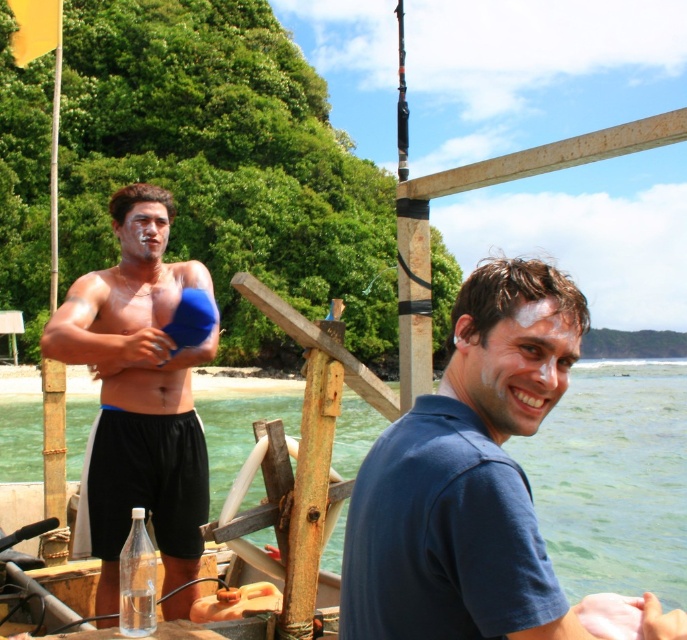
Question: Which is nearer to the clear plastic bottle at center?

Choices:
 (A) black matte shorts at left
 (B) blue cotton shirt at center
 (C) clear water at boat right

Answer: (B)

Question: Among these objects, which one is nearest to the camera?

Choices:
 (A) black matte shorts at left
 (B) clear plastic bottle at center
 (C) clear water at boat right
 (D) blue cotton shirt at center

Answer: (D)

Question: Which object is positioned closest to the black matte shorts at left?

Choices:
 (A) blue cotton shirt at center
 (B) clear water at boat right
 (C) clear plastic bottle at center

Answer: (C)

Question: Is blue cotton shirt at center smaller than black matte shorts at left?

Choices:
 (A) no
 (B) yes

Answer: (B)

Question: Does black matte shorts at left have a greater width compared to clear plastic bottle at center?

Choices:
 (A) yes
 (B) no

Answer: (A)

Question: Is blue cotton shirt at center thinner than clear plastic bottle at center?

Choices:
 (A) yes
 (B) no

Answer: (B)